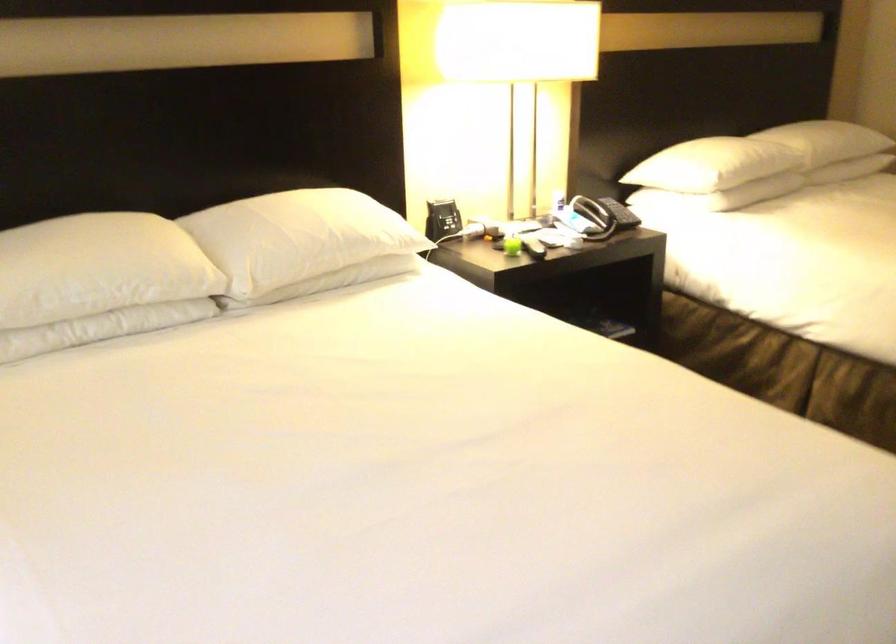
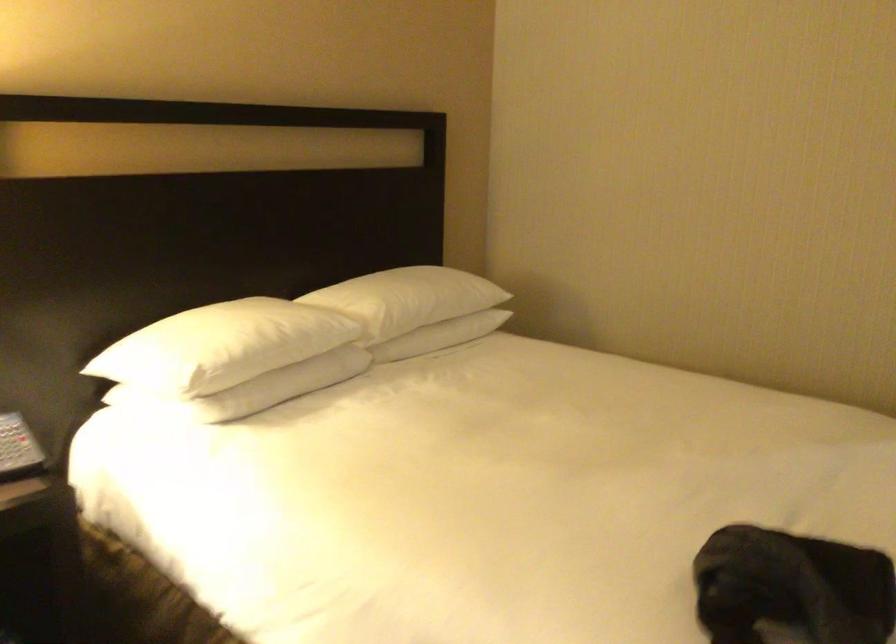
Find the pixel in the second image that matches pixel 623 214 in the first image.

(15, 448)